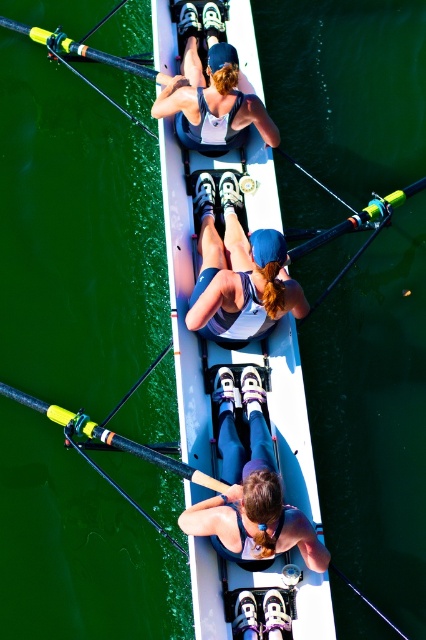
You are standing at the point labeled point (224, 257) and want to take a photo of the rowing boat. The camera you have can capture objects up to 20 feet away. Will the boat be in focus?

The distance between point (224, 257) and the camera is 20.85 feet, which exceeds the camera maximum range of 20 feet. Therefore, the boat will not be in focus.

You are a photographer trying to capture the rowing team members in the boat. You need to ensure that both the matte purple leggings at center and the matte blue tank top at upper center are clearly visible in the photo. Given their sizes, which clothing item might require you to adjust your camera focus more carefully to avoid blurriness?

The matte purple leggings at center is smaller than the matte blue tank top at upper center, so the smaller size of the matte purple leggings at center may require more careful focus adjustment to ensure clarity in the photo.

You are a photographer trying to capture the white glossy boat at center and the matte blue tank top at center in a single shot. Based on their sizes, which object should you focus on first to ensure both are in frame?

The white glossy boat at center is larger in size than the matte blue tank top at center, so you should focus on the white glossy boat at center first to ensure both are in frame.